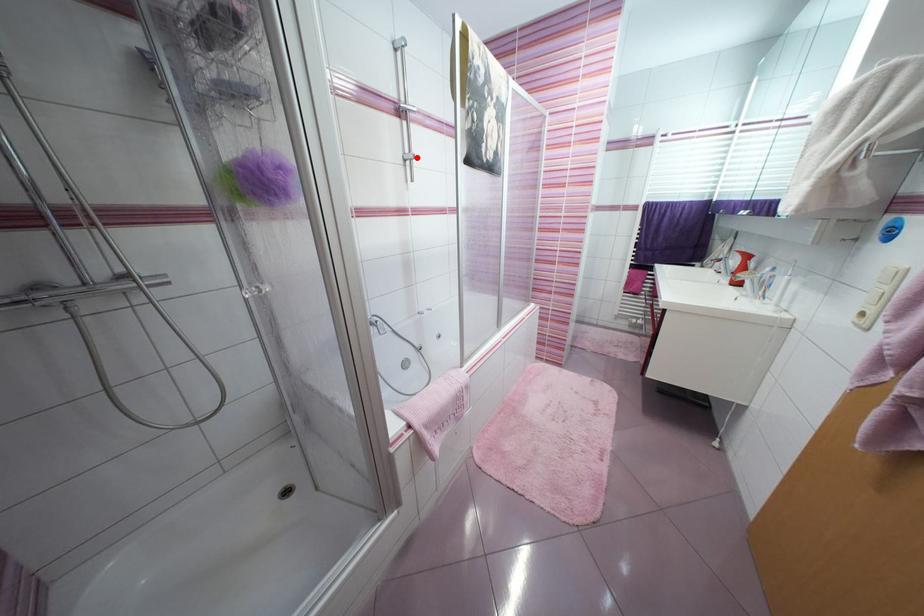
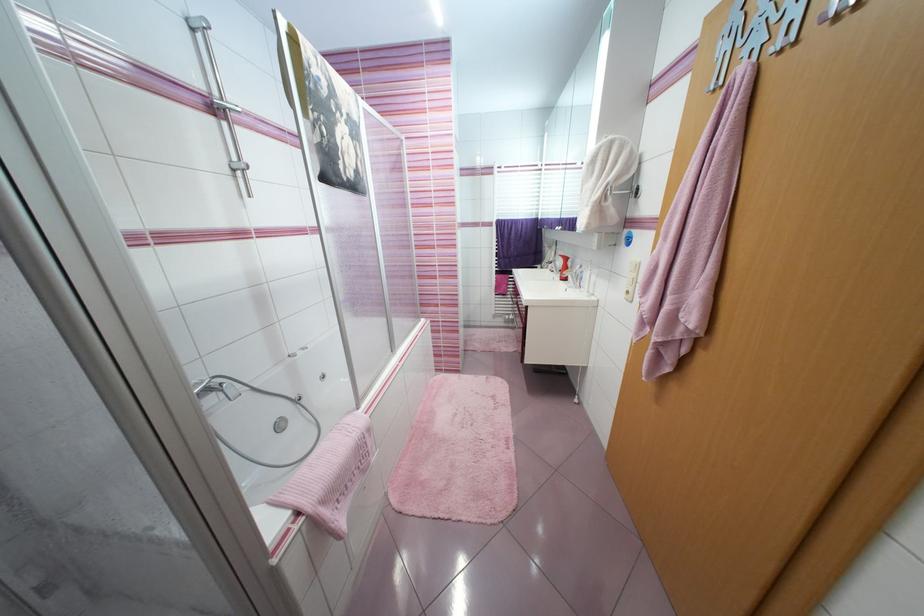
Question: I am providing you with two images of the same scene from different viewpoints. A red point is shown in image1. For the corresponding object point in image2, is it positioned nearer or farther from the camera?

Choices:
 (A) Nearer
 (B) Farther

Answer: (B)